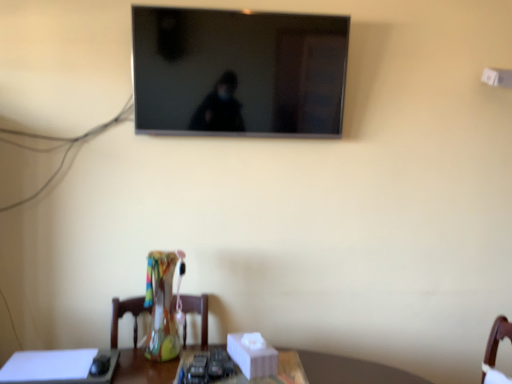
What do you see at coordinates (238, 72) in the screenshot? Image resolution: width=512 pixels, height=384 pixels. I see `flat screen tv at upper center` at bounding box center [238, 72].

What is the approximate width of flat screen tv at upper center?

The width of flat screen tv at upper center is 3.89 inches.

At what (x,y) coordinates should I click in order to perform the action: click on flat screen tv at upper center. Please return your answer as a coordinate pair (x, y). This screenshot has height=384, width=512. Looking at the image, I should click on (238, 72).

Where is `flat screen tv at upper center`? The width and height of the screenshot is (512, 384). flat screen tv at upper center is located at coordinates (238, 72).